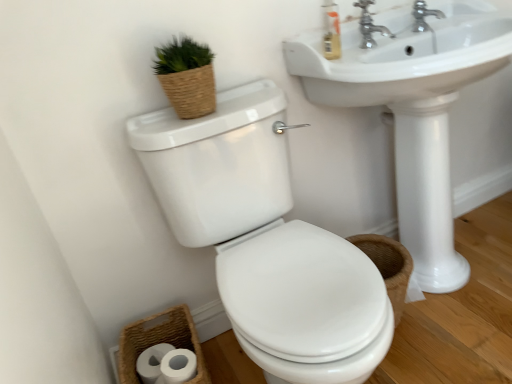
This screenshot has height=384, width=512. Find the location of `vacant space underneath white glossy sink at center (from a real-world perspective)`. vacant space underneath white glossy sink at center (from a real-world perspective) is located at coordinates coord(463,284).